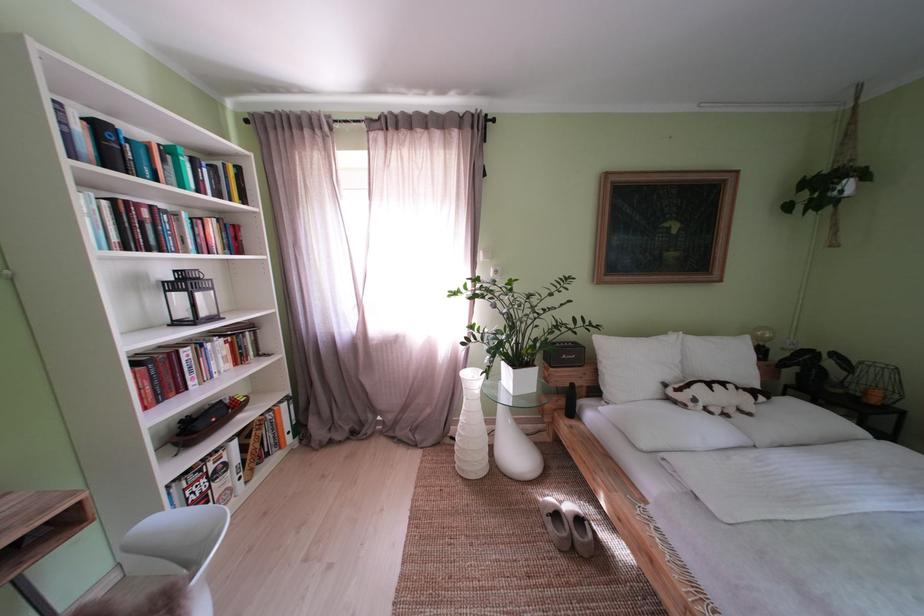
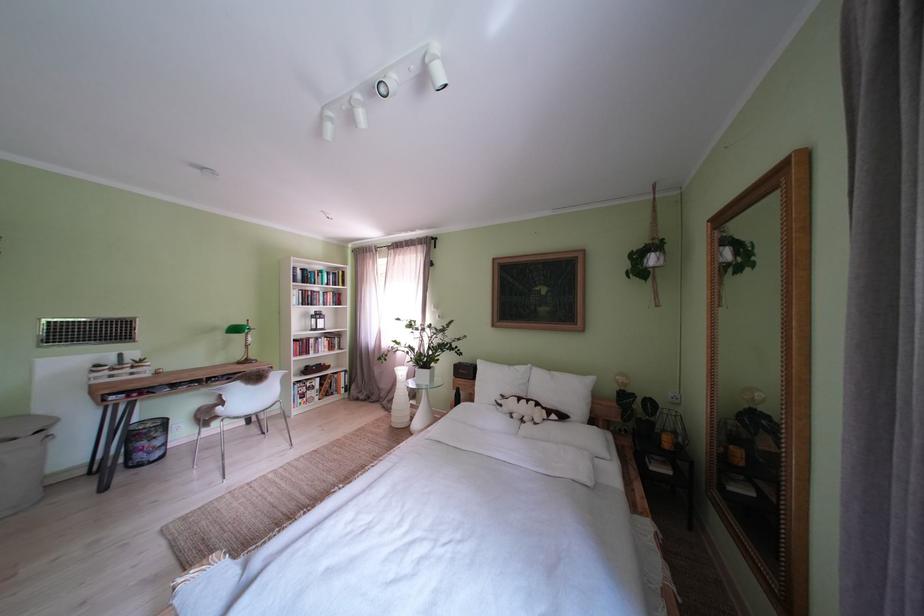
Find the pixel in the second image that matches (565,349) in the first image.

(472, 369)